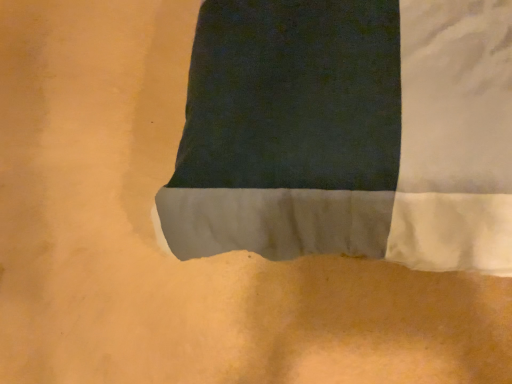
Question: Should I look upward or downward to see dark fabric curtain at center?

Choices:
 (A) up
 (B) down

Answer: (A)